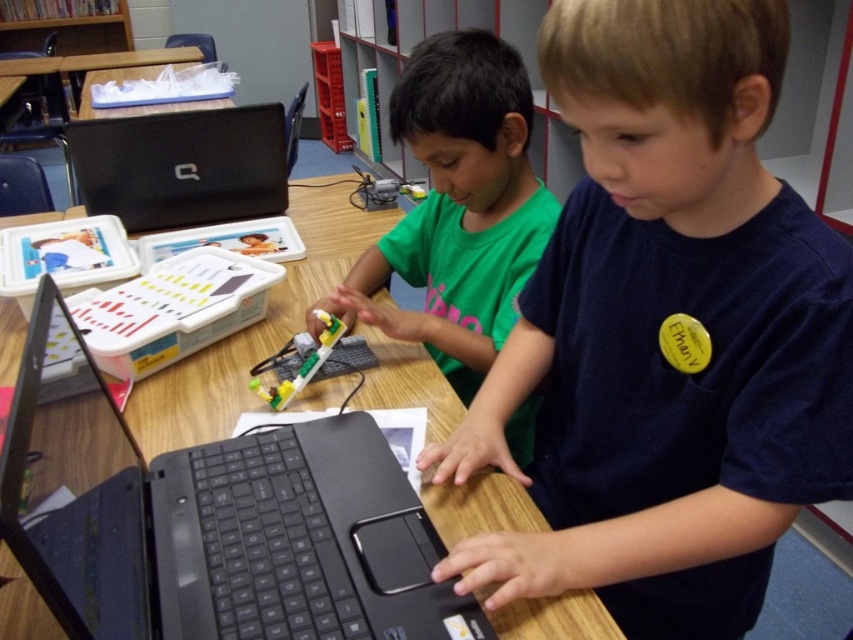
You are a robot navigating the classroom. You need to move from the point at coordinates point (248,508) to the point at coordinates point (535,234). Which direction should you move?

You should move backward because point (535,234) is behind point (248,508).

In the scene shown: You are a teacher observing the classroom scene. You notice two students working on a project involving a laptop and LEGO components. Which student, the dark blue shirt at center or the green matte shirt at center, is positioned closer to the front of the table?

The dark blue shirt at center is closer to the viewer than the green matte shirt at center, so the dark blue shirt at center is positioned closer to the front of the table.

You are a teacher in the classroom and need to move the black matte laptop at upper left to the desk on the right. Can you move it past the black matte laptop at center without moving the latter?

The black matte laptop at center is positioned on the right side of black matte laptop at upper left. Since the black matte laptop at center is already to the right of the black matte laptop at upper left, moving the upper left laptop to the right desk would require moving it past the center laptop. However, since the center laptop is in the way, you cannot move the upper left laptop past it without moving the center laptop first.